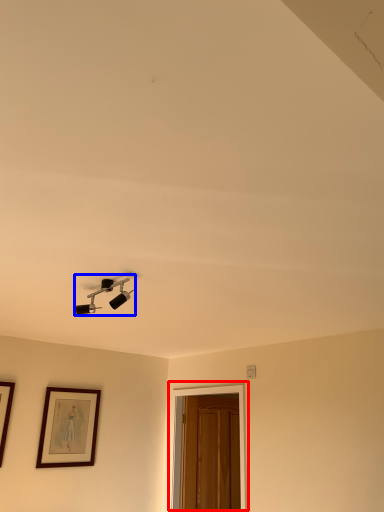
Question: Which point is closer to the camera, glass door (highlighted by a red box) or lamp (highlighted by a blue box)?

Choices:
 (A) glass door
 (B) lamp

Answer: (B)